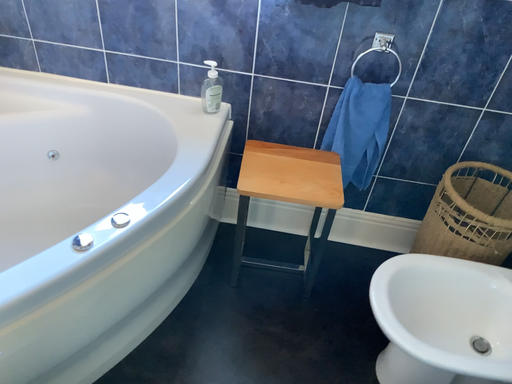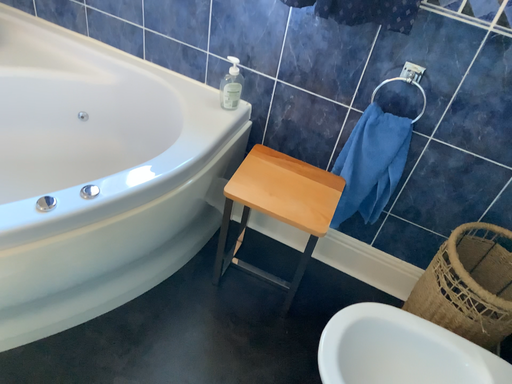
Question: How did the camera likely rotate when shooting the video?

Choices:
 (A) rotated right
 (B) rotated left

Answer: (B)